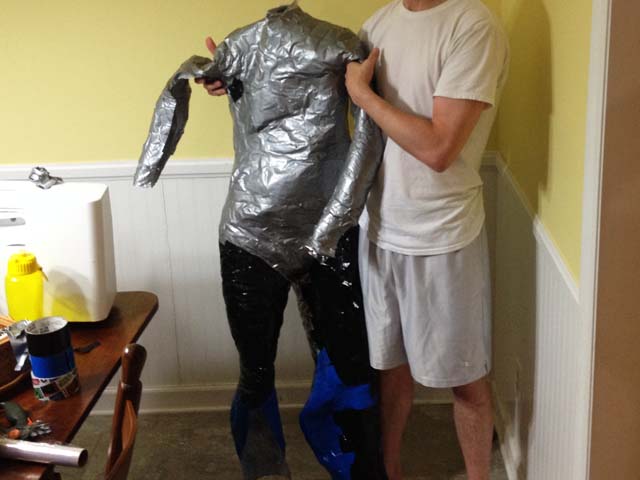
Locate an element on the screen. The image size is (640, 480). baseboard is located at coordinates (184, 399).